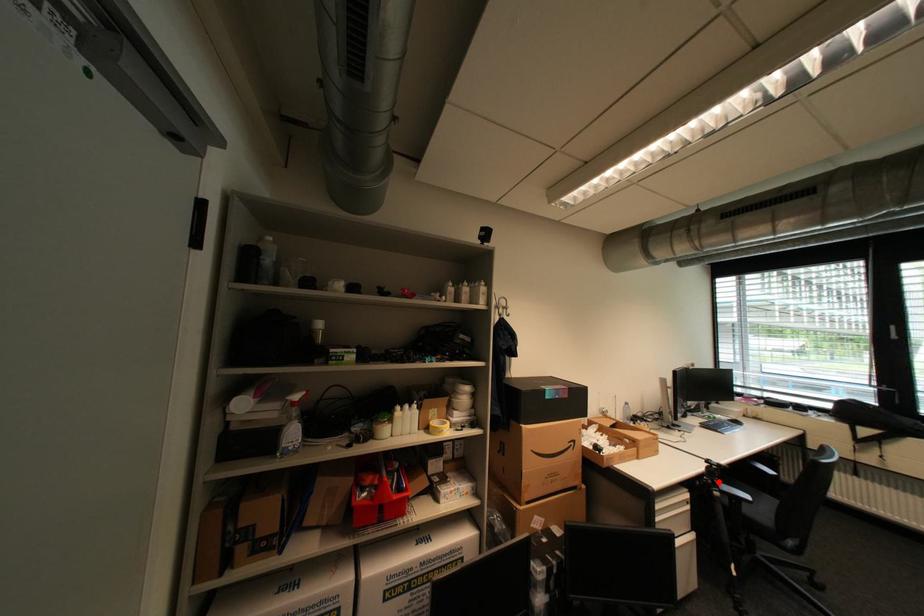
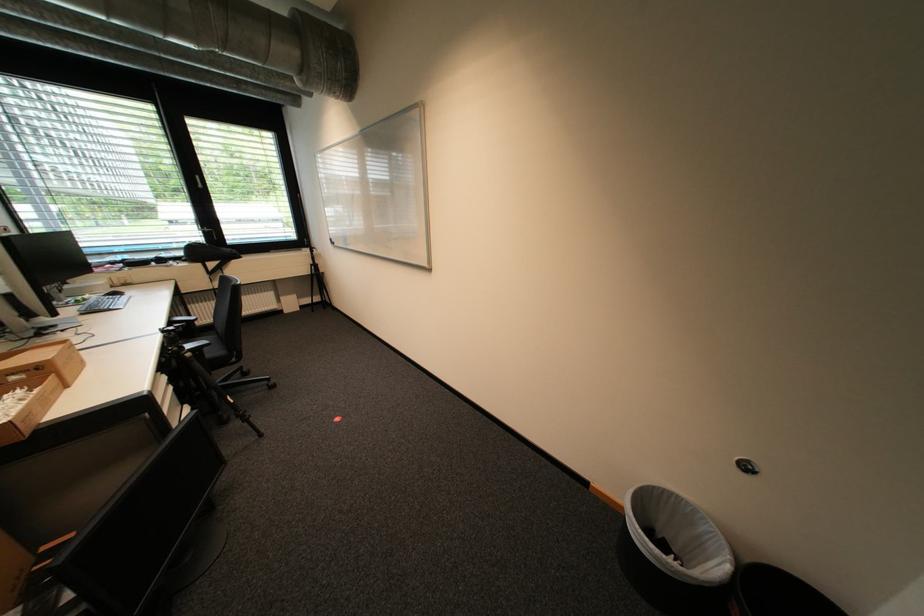
Question: I am providing you with two images of the same scene from different viewpoints. In image1, a red point is highlighted. Considering the same 3D point in image2, which of the following is correct?

Choices:
 (A) It is closer
 (B) It is farther

Answer: (A)